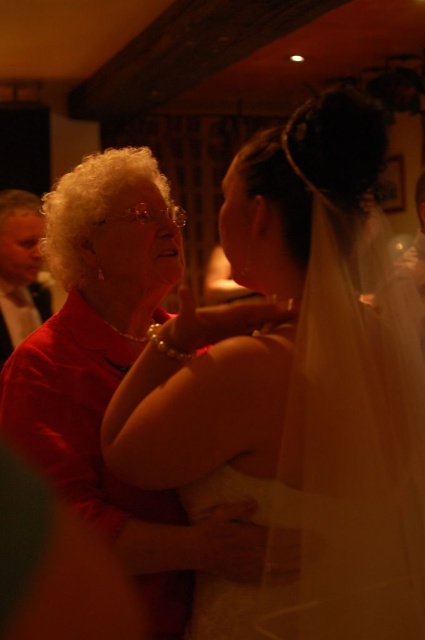
You are a photographer at a wedding and need to adjust the lighting to ensure both the white satin dress at center and the matte red shirt at left are well lit. Given their positions and heights, which garment should you focus on first to avoid shadows?

The white satin dress at center is shorter than the matte red shirt at left, so focusing on the shorter white satin dress at center first would help avoid shadows caused by the taller matte red shirt at left blocking light.